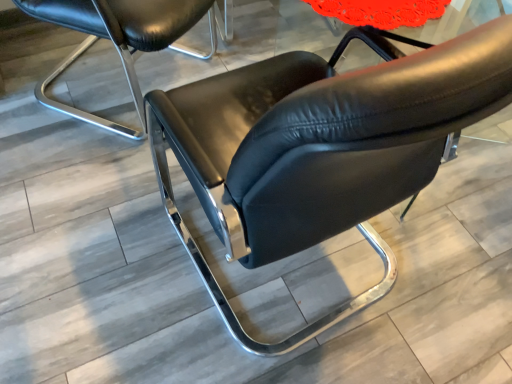
Locate an element on the screen. The width and height of the screenshot is (512, 384). free region on the left part of matte black chair at center, which is the 2th chair from right to left is located at coordinates (33, 70).